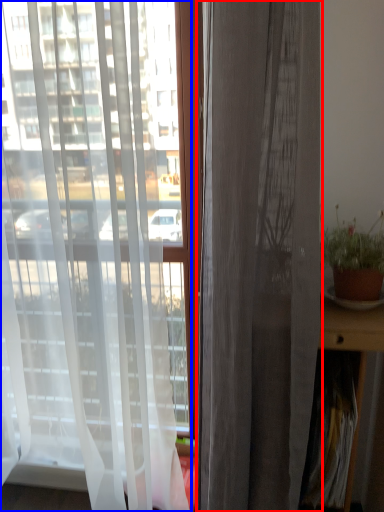
Question: Which object is further to the camera taking this photo, curtain (highlighted by a red box) or curtain (highlighted by a blue box)?

Choices:
 (A) curtain
 (B) curtain

Answer: (B)